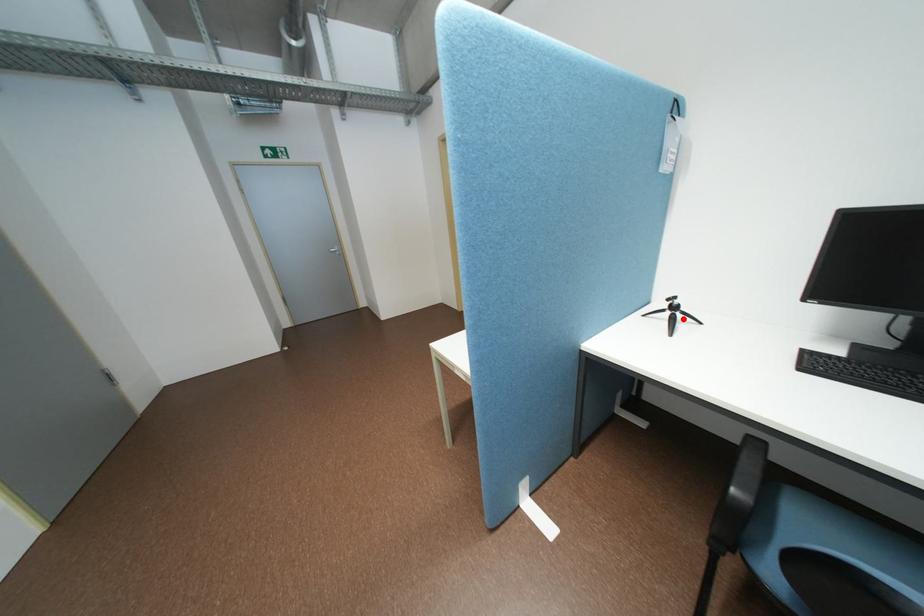
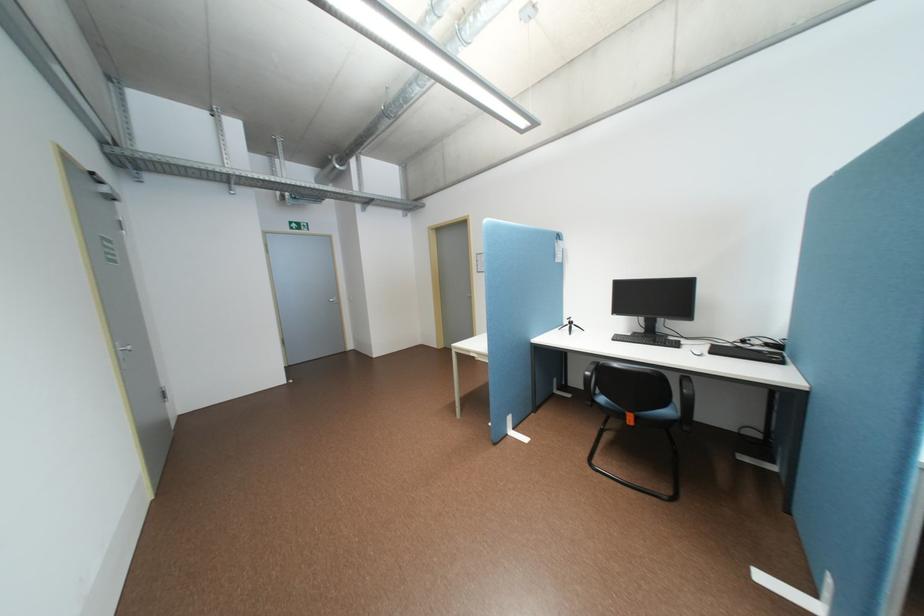
In the second image, find the point that corresponds to the highlighted location in the first image.

(581, 328)